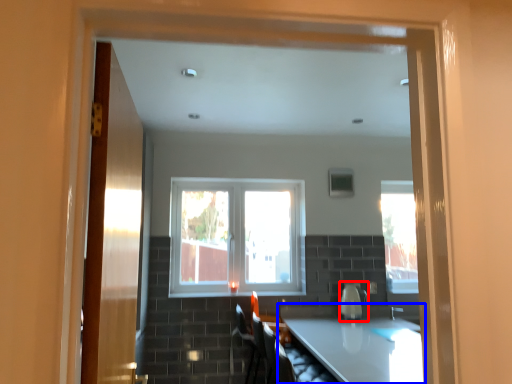
Question: Which point is further to the camera, appliance (highlighted by a red box) or countertop (highlighted by a blue box)?

Choices:
 (A) appliance
 (B) countertop

Answer: (A)